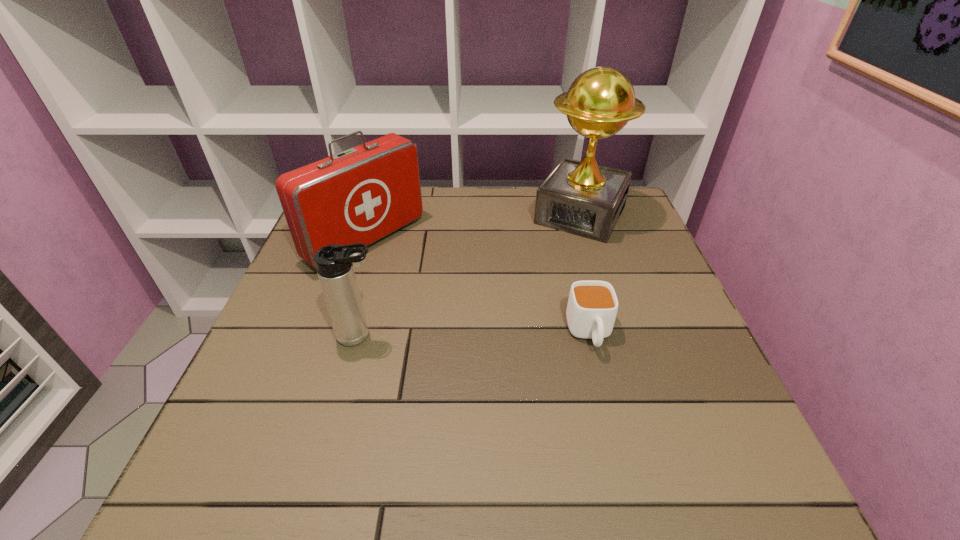
Identify the location of unoccupied position between the tallest object and the second shortest object. The height and width of the screenshot is (540, 960). (470, 275).

Where is `vacant space in between the thermos bottle and the tallest object`? The width and height of the screenshot is (960, 540). vacant space in between the thermos bottle and the tallest object is located at coordinates (470, 275).

At what (x,y) coordinates should I click in order to perform the action: click on empty location between the award and the second tallest object. Please return your answer as a coordinate pair (x, y). The image size is (960, 540). Looking at the image, I should click on (473, 227).

Find the location of `free space that is in between the third shortest object and the award`. free space that is in between the third shortest object and the award is located at coordinates (473, 227).

This screenshot has height=540, width=960. What are the coordinates of `empty space that is in between the tallest object and the thermos bottle` in the screenshot? It's located at (470, 275).

The width and height of the screenshot is (960, 540). Find the location of `vacant space in between the tallest object and the first-aid kit`. vacant space in between the tallest object and the first-aid kit is located at coordinates (473, 227).

Find the location of a particular element. the closest object to the cup is located at coordinates (583, 198).

Identify which object is the closest to the award. Please provide its 2D coordinates. Your answer should be formatted as a tuple, i.e. [(x, y)], where the tuple contains the x and y coordinates of a point satisfying the conditions above.

[(592, 307)]

You are a GUI agent. You are given a task and a screenshot of the screen. Output one action in this format:
    pyautogui.click(x=<x>, y=<y>)
    Task: Click on the vacant space that satisfies the following two spatial constraints: 1. on the front side of the second shortest object; 2. on the handle side of the third shortest object
    
    Given the screenshot: What is the action you would take?
    pyautogui.click(x=335, y=335)